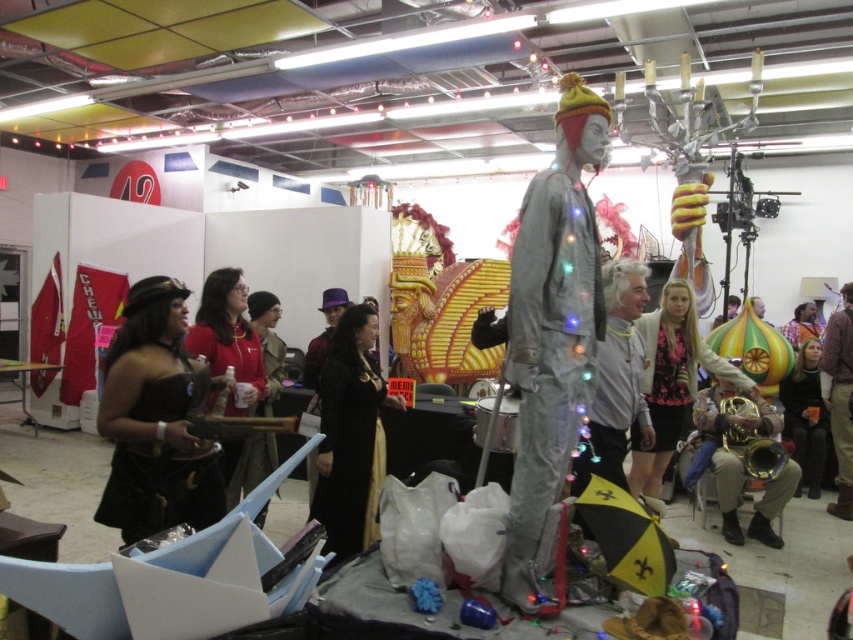
Between black leather dress at lower left and black velvet dress at center, which one is positioned higher?

black leather dress at lower left is higher up.

Consider the image. Between black leather dress at lower left and black velvet dress at center, which one appears on the left side from the viewer's perspective?

black leather dress at lower left is more to the left.

What do you see at coordinates (155, 451) in the screenshot? This screenshot has height=640, width=853. I see `black leather dress at lower left` at bounding box center [155, 451].

Find the location of `black leather dress at lower left`. black leather dress at lower left is located at coordinates (155, 451).

Can you confirm if black velvet dress at center is positioned above brown leather jacket at right?

No.

Does black velvet dress at center have a lesser width compared to brown leather jacket at right?

Yes.

This screenshot has width=853, height=640. What do you see at coordinates (349, 454) in the screenshot?
I see `black velvet dress at center` at bounding box center [349, 454].

Where is `black velvet dress at center`? This screenshot has width=853, height=640. black velvet dress at center is located at coordinates (349, 454).

Looking at this image, does gray fabric mannequin at center have a lesser width compared to brown leather jacket at right?

No, gray fabric mannequin at center is not thinner than brown leather jacket at right.

Does gray fabric mannequin at center appear on the right side of brown leather jacket at right?

No, gray fabric mannequin at center is not to the right of brown leather jacket at right.

Measure the distance between point (x=628, y=326) and camera.

Point (x=628, y=326) is 3.65 meters from camera.

At what (x,y) coordinates should I click in order to perform the action: click on gray fabric mannequin at center. Please return your answer as a coordinate pair (x, y). The height and width of the screenshot is (640, 853). Looking at the image, I should click on (616, 378).